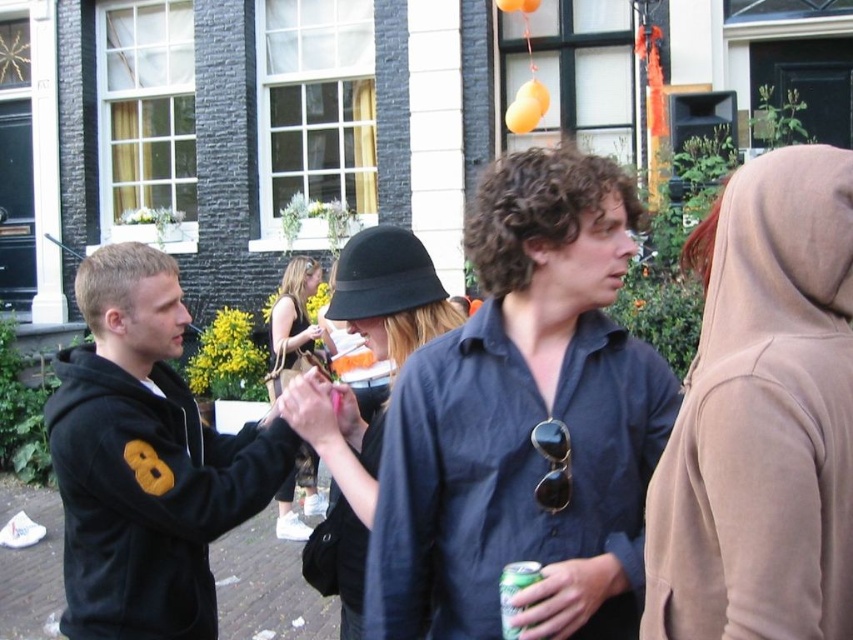
You are a photographer trying to capture a group photo of the black hoodie at left and the black leather hat at center. If you want to ensure both subjects are in focus, which subject should you focus on first to account for their sizes?

Since the black hoodie at left is wider than the black leather hat at center, you should focus on the black hoodie at left first to ensure both are in focus.

You are a delivery robot with a 20 inch wide package. You need to move from the beige fleece hoodie at right to the green metallic can at center. Can you fit through the space between them?

The distance between the beige fleece hoodie at right and the green metallic can at center is 25.78 inches. Since the package is 20 inches wide, the robot can fit through the space between them as there is enough clearance.

You are standing at the center of the scene. Which direction should you walk to reach the black hoodie at left?

Since the black hoodie at left is located at point (144, 460), you should walk to the left to reach it.